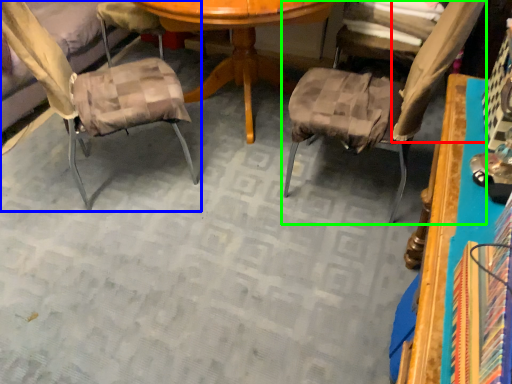
Question: Estimate the real-world distances between objects in this image. Which object is farther from fabric (highlighted by a red box), chair (highlighted by a blue box) or chair (highlighted by a green box)?

Choices:
 (A) chair
 (B) chair

Answer: (A)